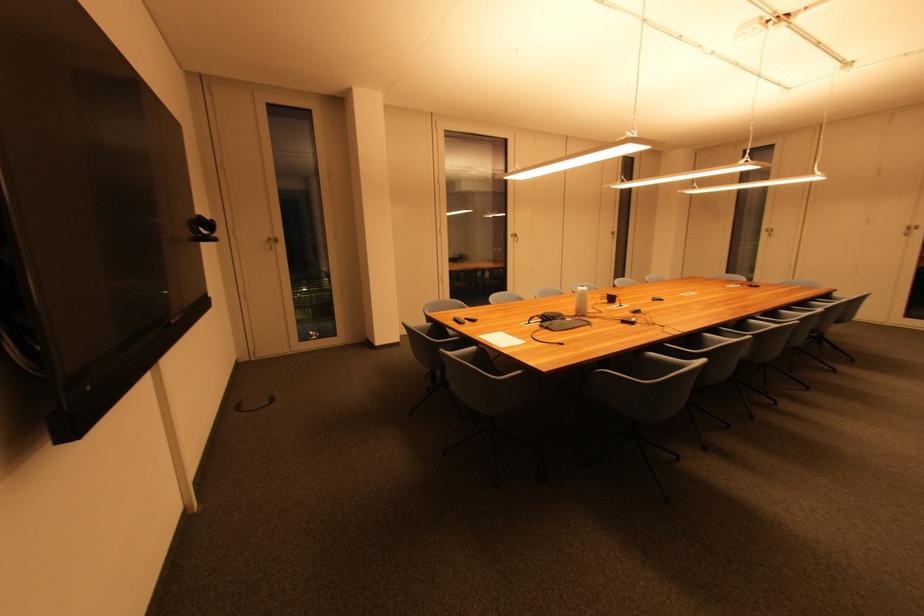
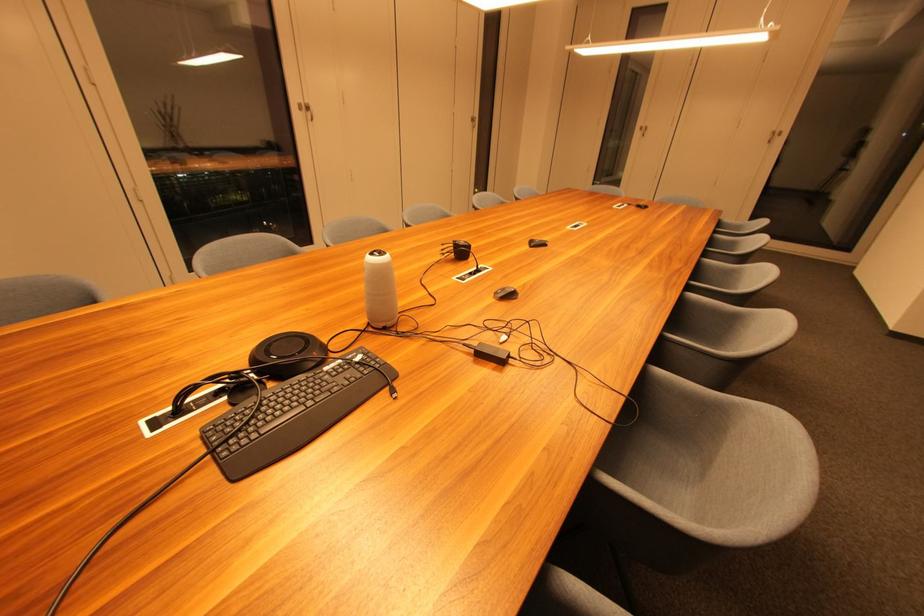
Locate, in the second image, the point that corresponds to (533,325) in the first image.

(185, 414)